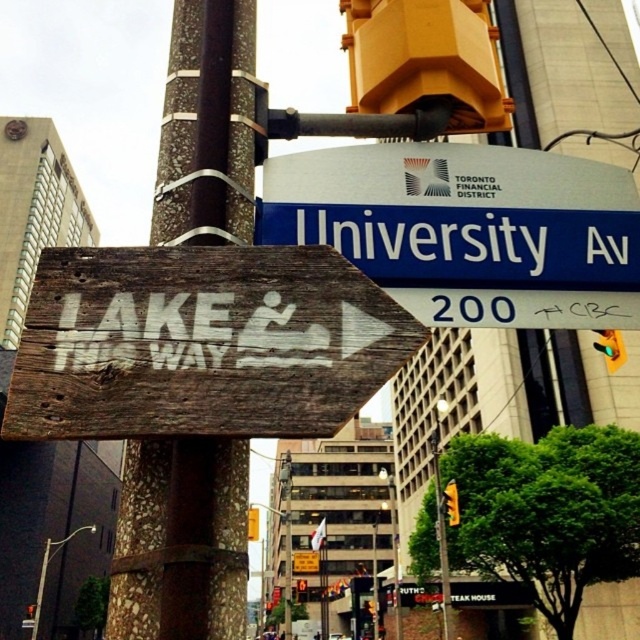
The width and height of the screenshot is (640, 640). Describe the element at coordinates (180, 540) in the screenshot. I see `brown textured pole at center` at that location.

Between point (188, 442) and point (410, 211), which one is positioned behind?

The point (410, 211) is behind.

This screenshot has width=640, height=640. Identify the location of brown textured pole at center. (180, 540).

Find the location of `brown textured pole at center`. brown textured pole at center is located at coordinates (180, 540).